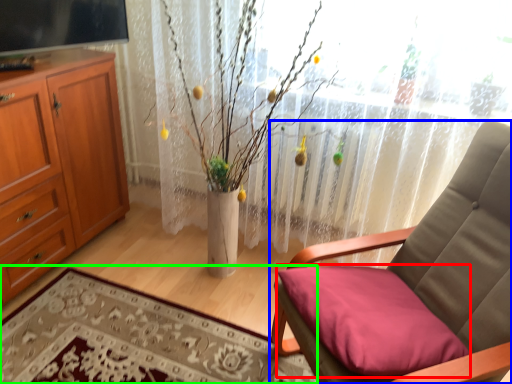
Question: Estimate the real-world distances between objects in this image. Which object is farther from pillow (highlighted by a red box), chair (highlighted by a blue box) or plain (highlighted by a green box)?

Choices:
 (A) chair
 (B) plain

Answer: (B)